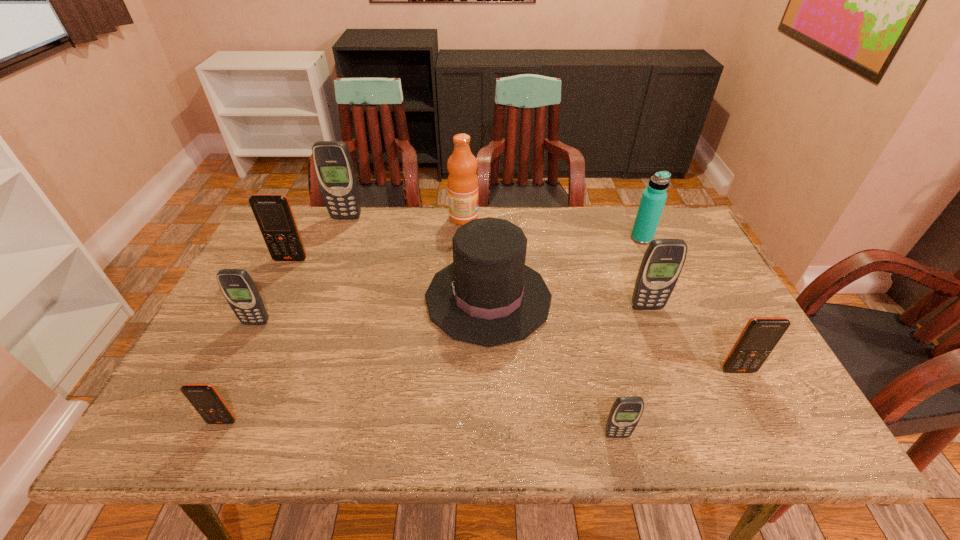
I want to click on free space between the nearest orange cellular telephone and the biggest orange cellular telephone, so click(256, 340).

At what (x,y) coordinates should I click in order to perform the action: click on free spot between the third biggest gray cellular telephone and the farthest cellular telephone. Please return your answer as a coordinate pair (x, y). Looking at the image, I should click on (301, 270).

Identify the location of free spot between the purple dress hat and the tallest cellular telephone. This screenshot has height=540, width=960. (418, 258).

The width and height of the screenshot is (960, 540). What are the coordinates of `empty space between the water bottle and the dress hat` in the screenshot? It's located at (565, 268).

Where is `vacant space that's between the rightmost object and the fruit juice`? This screenshot has width=960, height=540. vacant space that's between the rightmost object and the fruit juice is located at coordinates (601, 294).

I want to click on free spot between the seventh object from right to left and the fruit juice, so click(x=405, y=218).

I want to click on empty location between the fruit juice and the water bottle, so click(x=553, y=228).

You are a GUI agent. You are given a task and a screenshot of the screen. Output one action in this format:
    pyautogui.click(x=<x>, y=<y>)
    Task: Click on the object identified as the fourth closest to the eighth farthest object
    The width and height of the screenshot is (960, 540).
    Given the screenshot: What is the action you would take?
    pyautogui.click(x=653, y=199)

The width and height of the screenshot is (960, 540). I want to click on object that is the fifth nearest to the fourth nearest cellular telephone, so click(462, 165).

Where is `cellular telephone that stands as the sixth closest to the fruit juice`? cellular telephone that stands as the sixth closest to the fruit juice is located at coordinates (760, 336).